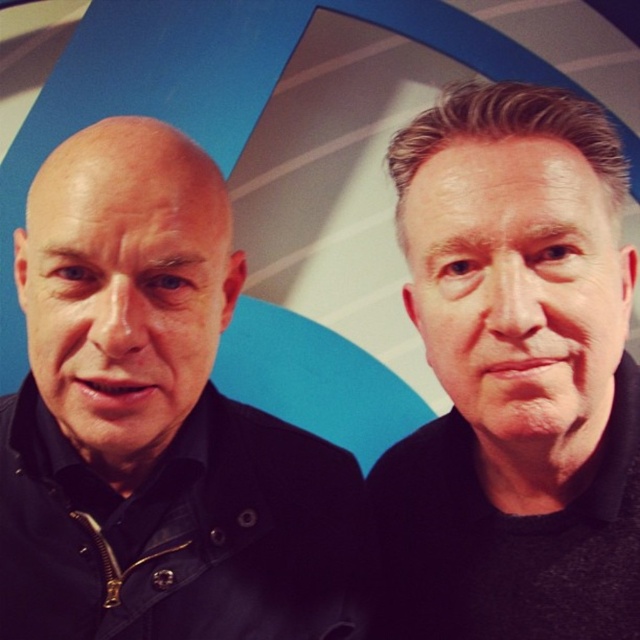
Which is in front, point (582, 257) or point (224, 276)?

Point (582, 257) is in front.

Where is `smooth skin face at right`? This screenshot has height=640, width=640. smooth skin face at right is located at coordinates (518, 288).

Based on the photo, between black matte jacket at left and black matte jacket at right, which one has less height?

With less height is black matte jacket at left.

Identify the location of black matte jacket at left. The image size is (640, 640). (154, 422).

At what (x,y) coordinates should I click in order to perform the action: click on black matte jacket at left. Please return your answer as a coordinate pair (x, y). The width and height of the screenshot is (640, 640). Looking at the image, I should click on 154,422.

Does black matte jacket at right have a lesser width compared to smooth skin face at right?

No, black matte jacket at right is not thinner than smooth skin face at right.

Can you confirm if black matte jacket at right is shorter than smooth skin face at right?

Incorrect, black matte jacket at right's height does not fall short of smooth skin face at right's.

Which is in front, point (490, 163) or point (552, 202)?

Positioned in front is point (552, 202).

You are a GUI agent. You are given a task and a screenshot of the screen. Output one action in this format:
    pyautogui.click(x=<x>, y=<y>)
    Task: Click on the black matte jacket at right
    This screenshot has width=640, height=640.
    Given the screenshot: What is the action you would take?
    pyautogui.click(x=515, y=376)